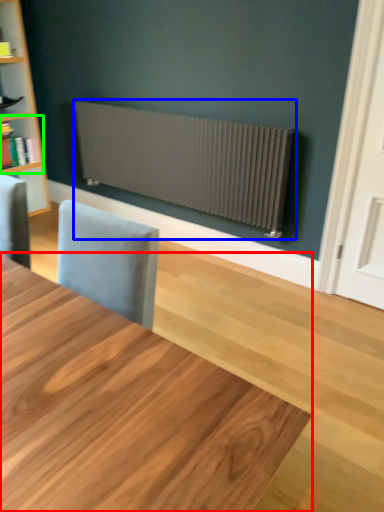
Question: Considering the real-world distances, which object is closest to table (highlighted by a red box)? radiator (highlighted by a blue box) or shelf (highlighted by a green box).

Choices:
 (A) radiator
 (B) shelf

Answer: (A)